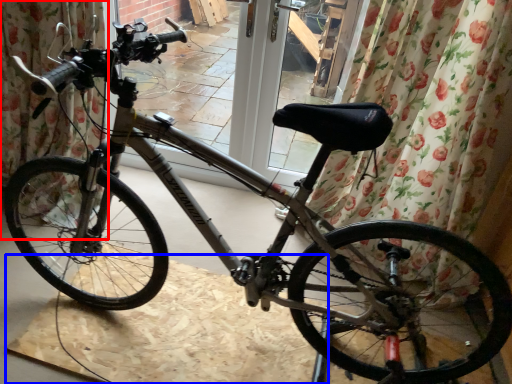
Question: Which object is further to the camera taking this photo, curtain (highlighted by a red box) or cardboard (highlighted by a blue box)?

Choices:
 (A) curtain
 (B) cardboard

Answer: (A)